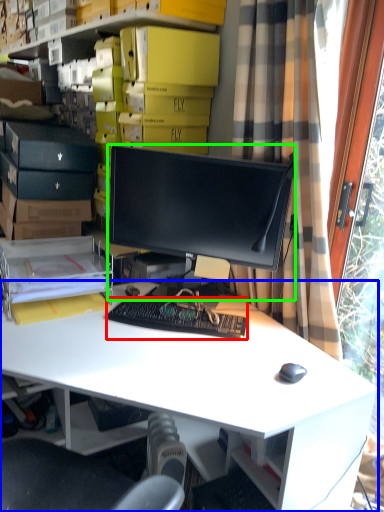
Question: Which is farther away from computer keyboard (highlighted by a red box)? desk (highlighted by a blue box) or computer monitor (highlighted by a green box)?

Choices:
 (A) desk
 (B) computer monitor

Answer: (B)